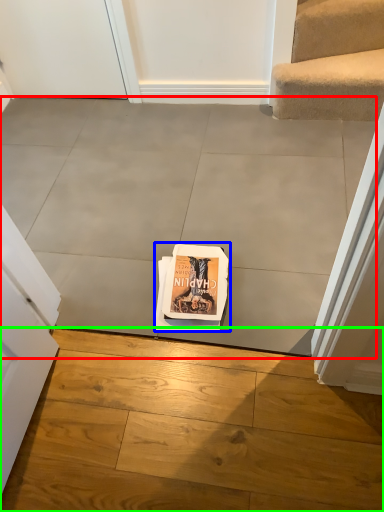
Question: Which is nearer to the concrete (highlighted by a red box)? paperback book (highlighted by a blue box) or concrete (highlighted by a green box).

Choices:
 (A) paperback book
 (B) concrete

Answer: (A)